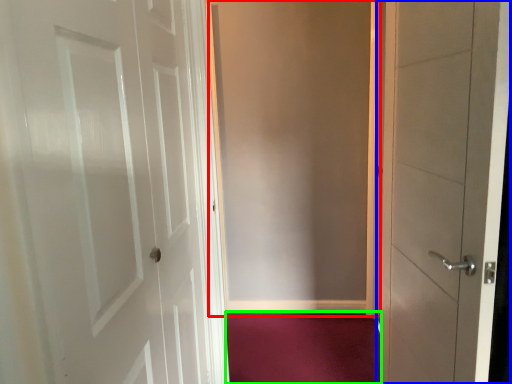
Question: Considering the real-world distances, which object is farthest from screen door (highlighted by a red box)? door (highlighted by a blue box) or plain (highlighted by a green box)?

Choices:
 (A) door
 (B) plain

Answer: (A)